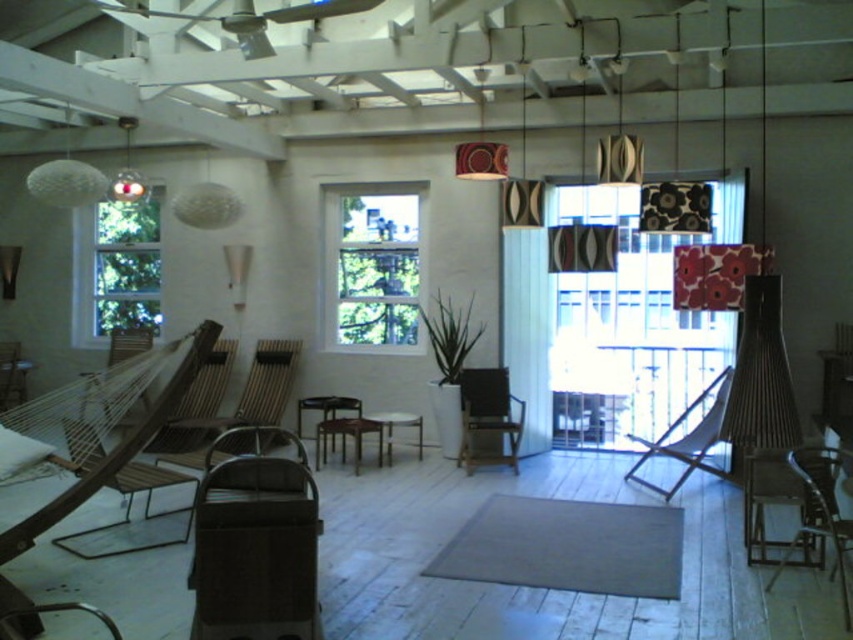
Who is shorter, wooden slatted chair at center or wooden armchair at lower right?

wooden armchair at lower right is shorter.

Which is behind, point (288, 374) or point (842, 586)?

Point (288, 374)

You are a GUI agent. You are given a task and a screenshot of the screen. Output one action in this format:
    pyautogui.click(x=<x>, y=<y>)
    Task: Click on the wooden slatted chair at center
    This screenshot has height=640, width=853.
    Given the screenshot: What is the action you would take?
    pyautogui.click(x=241, y=410)

Is wooden slatted chair at center taller than wooden armchair at left?

Yes, wooden slatted chair at center is taller than wooden armchair at left.

Is the position of wooden slatted chair at center more distant than that of wooden armchair at left?

No, wooden slatted chair at center is closer to the viewer.

The height and width of the screenshot is (640, 853). What do you see at coordinates (241, 410) in the screenshot?
I see `wooden slatted chair at center` at bounding box center [241, 410].

Image resolution: width=853 pixels, height=640 pixels. Find the location of `wooden slatted chair at center`. wooden slatted chair at center is located at coordinates (241, 410).

Which of these two, wooden armchair at lower right or wooden slatted chair at left, stands shorter?

wooden armchair at lower right is shorter.

Does wooden armchair at lower right have a greater height compared to wooden slatted chair at left?

No, wooden armchair at lower right is not taller than wooden slatted chair at left.

Describe the element at coordinates (821, 512) in the screenshot. I see `wooden armchair at lower right` at that location.

At what (x,y) coordinates should I click in order to perform the action: click on wooden armchair at lower right. Please return your answer as a coordinate pair (x, y). Looking at the image, I should click on (821, 512).